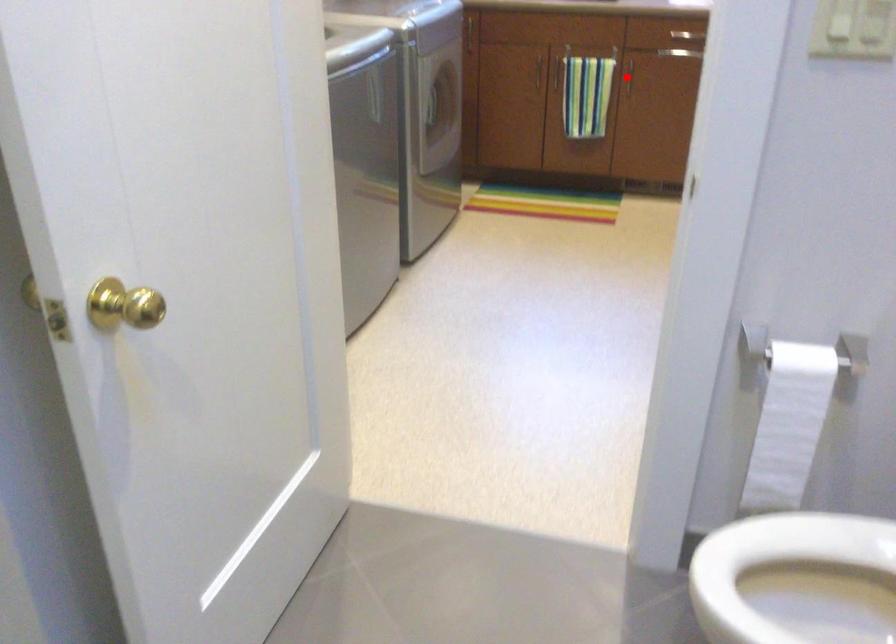
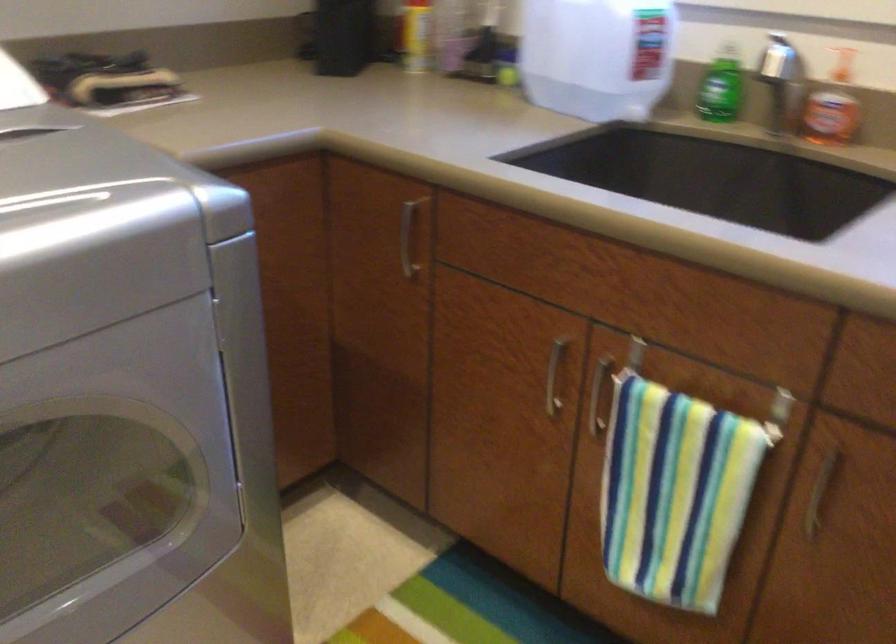
Where in the second image is the point corresponding to the highlighted location from the first image?

(819, 494)